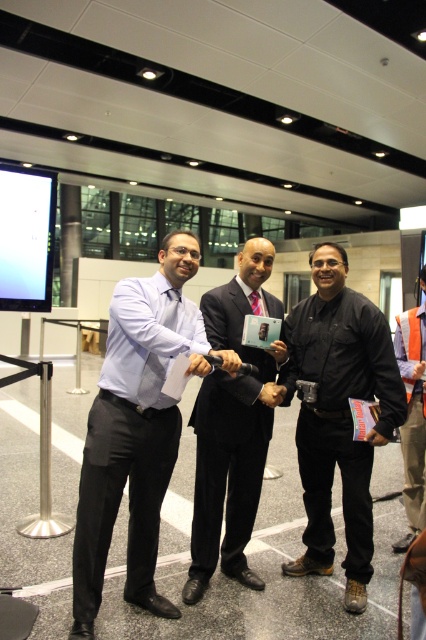
Does matte blue shirt at center appear on the left side of shiny black suit at center?

Indeed, matte blue shirt at center is positioned on the left side of shiny black suit at center.

Is point (85, 515) farther from viewer compared to point (195, 550)?

No.

I want to click on matte blue shirt at center, so click(135, 429).

Can you confirm if shiny black suit at center is positioned below orange safety vest at right?

No, shiny black suit at center is not below orange safety vest at right.

Is shiny black suit at center taller than orange safety vest at right?

Yes.

Is point (247, 580) farther from camera compared to point (417, 470)?

No, it is not.

This screenshot has height=640, width=426. Find the location of `shiny black suit at center`. shiny black suit at center is located at coordinates (233, 424).

Is black leather jacket at center to the right of orange safety vest at right from the viewer's perspective?

Incorrect, black leather jacket at center is not on the right side of orange safety vest at right.

Is point (365, 326) closer to camera compared to point (423, 308)?

Yes, point (365, 326) is in front of point (423, 308).

The image size is (426, 640). What are the coordinates of `black leather jacket at center` in the screenshot? It's located at (339, 413).